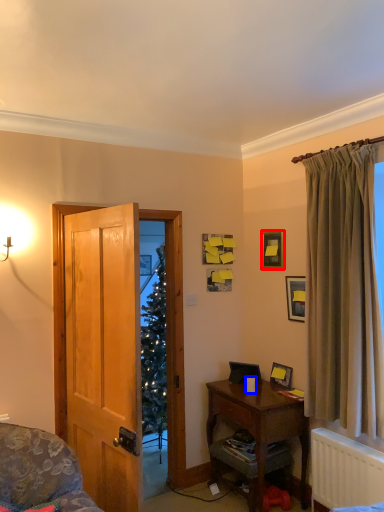
Question: Which object appears farthest to the camera in this image, picture frame (highlighted by a red box) or coffee cup (highlighted by a blue box)?

Choices:
 (A) picture frame
 (B) coffee cup

Answer: (A)